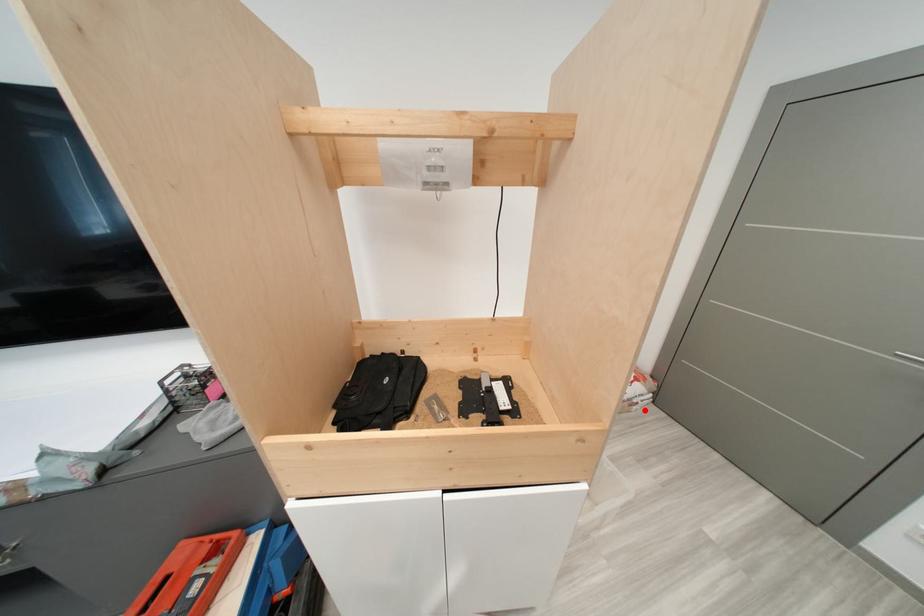
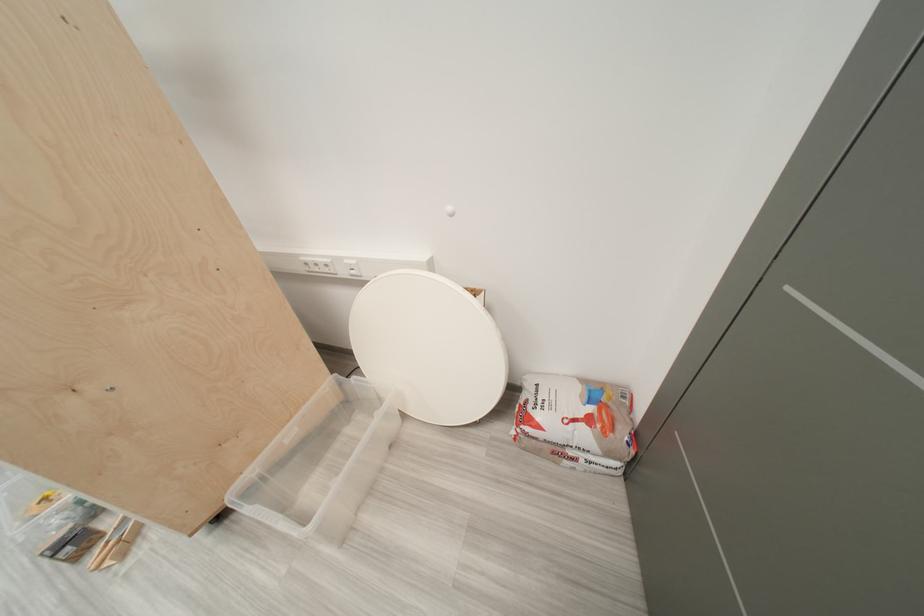
The point at the highlighted location is marked in the first image. Where is the corresponding point in the second image?

(577, 464)